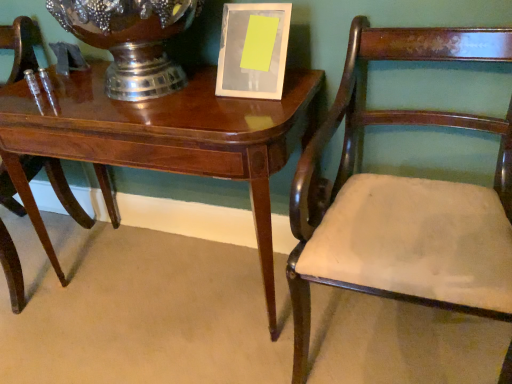
Question: Is glossy wood table at center facing towards mahogany wood chair at right, positioned as the first chair in right-to-left order?

Choices:
 (A) no
 (B) yes

Answer: (A)

Question: From the image's perspective, does glossy wood table at center appear lower than mahogany wood chair at right, the 2th chair viewed from the left?

Choices:
 (A) no
 (B) yes

Answer: (A)

Question: Is glossy wood table at center at the left side of mahogany wood chair at right, positioned as the first chair in right-to-left order?

Choices:
 (A) yes
 (B) no

Answer: (A)

Question: From the image's perspective, is glossy wood table at center on top of mahogany wood chair at right, positioned as the first chair in right-to-left order?

Choices:
 (A) yes
 (B) no

Answer: (A)

Question: Is glossy wood table at center facing away from mahogany wood chair at right, the 2th chair viewed from the left?

Choices:
 (A) yes
 (B) no

Answer: (B)

Question: From a real-world perspective, does glossy wood table at center sit lower than mahogany wood chair at right, the 2th chair viewed from the left?

Choices:
 (A) no
 (B) yes

Answer: (B)

Question: Does mahogany wood chair at left, the second chair positioned from the right, come in front of glossy wood table at center?

Choices:
 (A) no
 (B) yes

Answer: (A)

Question: From the image's perspective, does mahogany wood chair at left, the second chair positioned from the right, appear lower than glossy wood table at center?

Choices:
 (A) yes
 (B) no

Answer: (B)

Question: Is mahogany wood chair at left, the second chair positioned from the right, taller than glossy wood table at center?

Choices:
 (A) yes
 (B) no

Answer: (A)

Question: Is mahogany wood chair at left, the second chair positioned from the right, bigger than glossy wood table at center?

Choices:
 (A) no
 (B) yes

Answer: (A)

Question: From the image's perspective, does mahogany wood chair at left, the second chair positioned from the right, appear higher than glossy wood table at center?

Choices:
 (A) no
 (B) yes

Answer: (B)

Question: Does mahogany wood chair at left, the first chair viewed from the left, have a lesser height compared to glossy wood table at center?

Choices:
 (A) no
 (B) yes

Answer: (A)

Question: Does mahogany wood chair at right, the 2th chair viewed from the left, lie behind brushed metal vase at upper center?

Choices:
 (A) no
 (B) yes

Answer: (A)